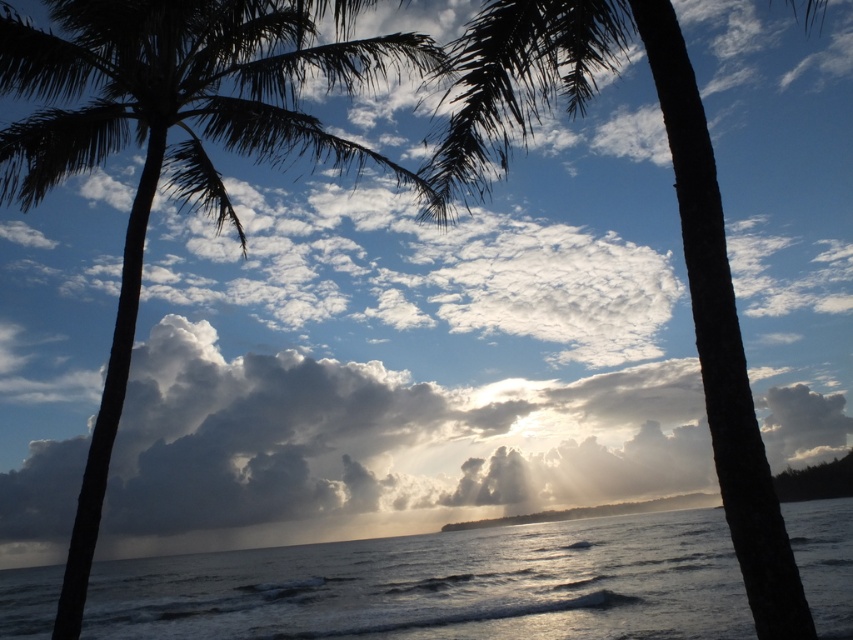
You are a photographer trying to capture the reflection of the palm tree in the water. Based on the scene, will the dark brown bark palm tree at center be fully reflected in the glistening silver water at center?

The glistening silver water at center has a larger size compared to dark brown bark palm tree at center, so yes, the dark brown bark palm tree at center will be fully reflected in the glistening silver water at center since the water is larger in size.

You are standing in the coastal scene and want to take a photo of both the silky black palm tree at left and the dark brown bark palm tree at center. Which palm tree should you position yourself to the left of to include both in your shot?

You should position yourself to the left of the silky black palm tree at left to include both the silky black palm tree at left and the dark brown bark palm tree at center in your photo, as the silky black palm tree at left is to the left of the dark brown bark palm tree at center.